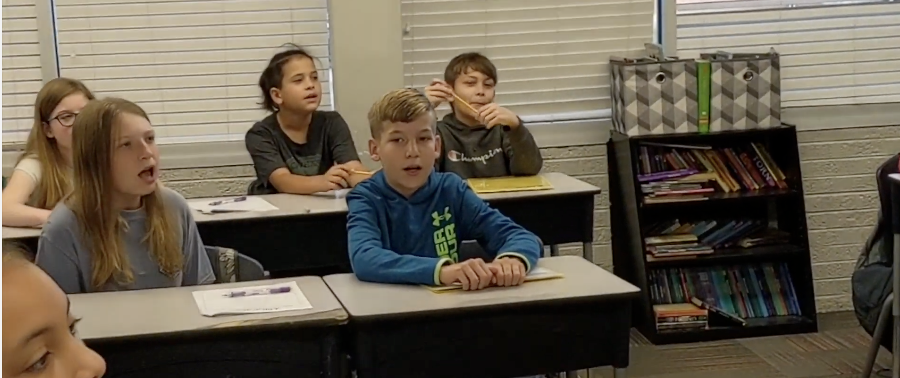
Where is `floor`? This screenshot has height=378, width=900. floor is located at coordinates (742, 357).